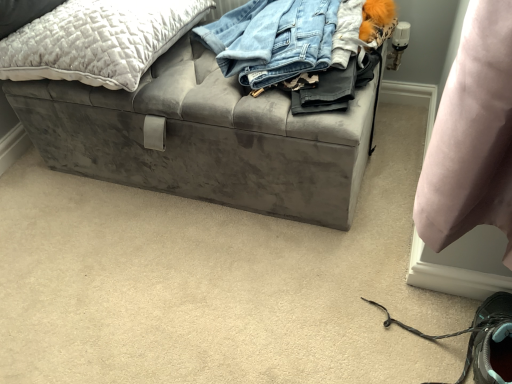
Where is `vacant space underneath gray suede shoe at lower right (from a real-world perspective)`? The image size is (512, 384). vacant space underneath gray suede shoe at lower right (from a real-world perspective) is located at coordinates (415, 339).